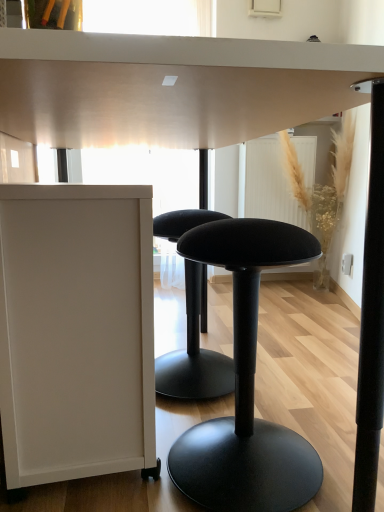
Measure the distance between point (286, 246) and camera.

34.92 inches.

Where is `black matte stool at center`? This screenshot has height=512, width=384. black matte stool at center is located at coordinates (246, 385).

What do you see at coordinates (246, 385) in the screenshot? I see `black matte stool at center` at bounding box center [246, 385].

Where is `black matte stool at center`? This screenshot has height=512, width=384. black matte stool at center is located at coordinates (246, 385).